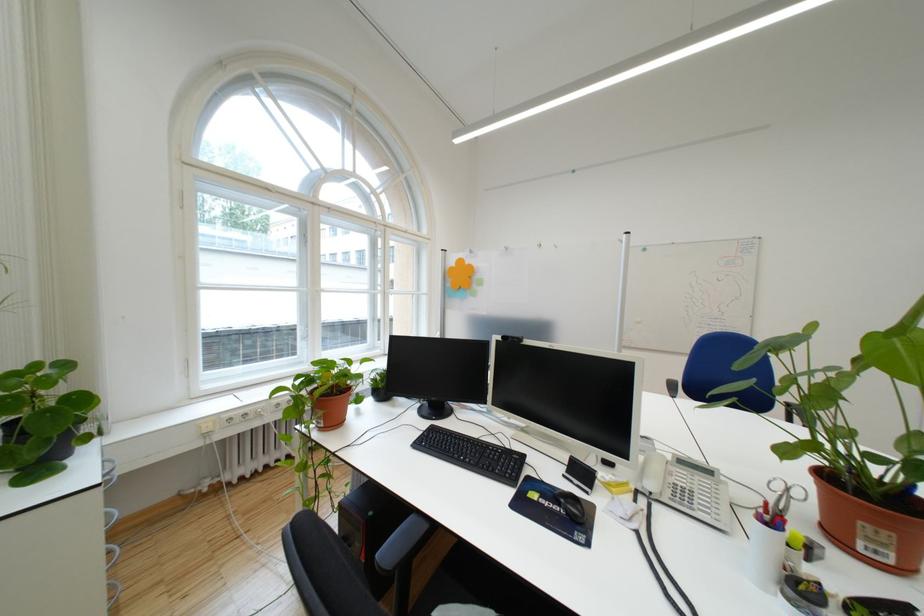
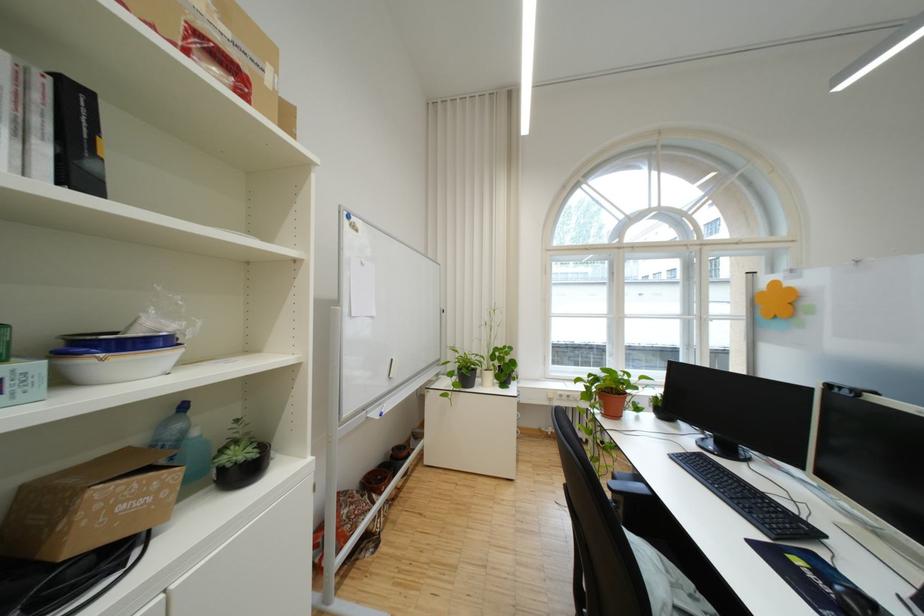
Locate, in the second image, the point that corresponds to (x=569, y=511) in the first image.

(841, 592)